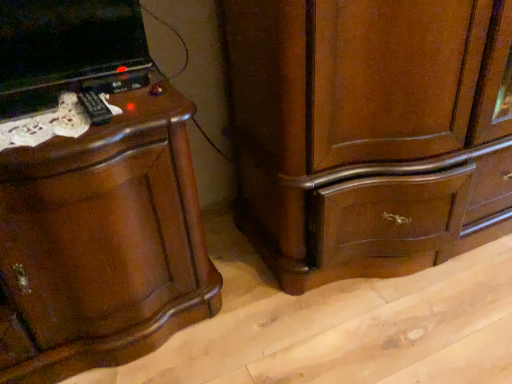
What is the approximate width of matte brown chest of drawers at left?

The width of matte brown chest of drawers at left is 24.24 inches.

Describe the element at coordinates (102, 235) in the screenshot. This screenshot has width=512, height=384. I see `matte brown chest of drawers at left` at that location.

What are the coordinates of `matte brown chest of drawers at left` in the screenshot? It's located at (102, 235).

Locate an element on the screen. matte brown chest of drawers at left is located at coordinates (102, 235).